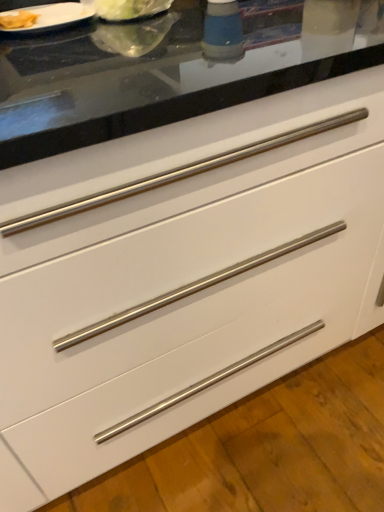
You are a GUI agent. You are given a task and a screenshot of the screen. Output one action in this format:
    pyautogui.click(x=<x>, y=<y>)
    Task: Click on the free point above white glossy plate at upper left (from a real-world perspective)
    The width and height of the screenshot is (384, 512).
    Given the screenshot: What is the action you would take?
    pyautogui.click(x=29, y=5)